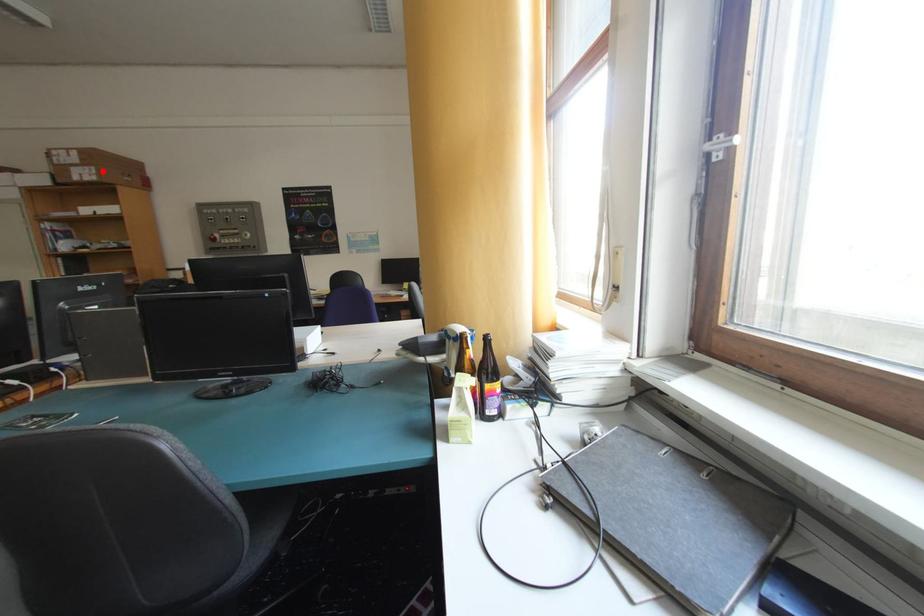
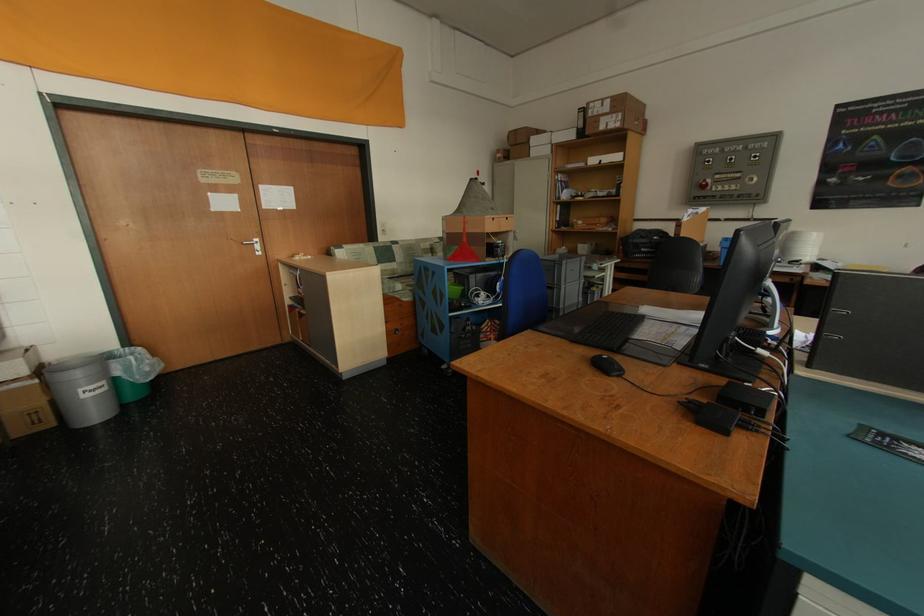
The point at the highlighted location is marked in the first image. Where is the corresponding point in the second image?

(628, 118)